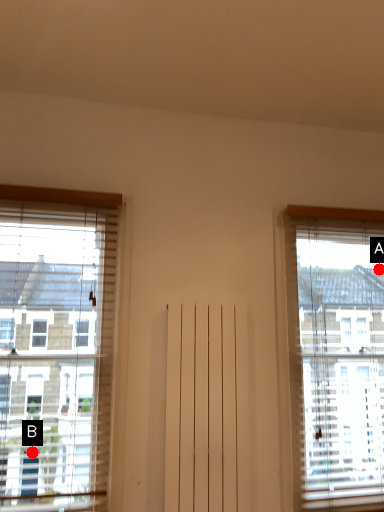
Question: Two points are circled on the image, labeled by A and B beside each circle. Which point appears farthest from the camera in this image?

Choices:
 (A) A is further
 (B) B is further

Answer: (A)